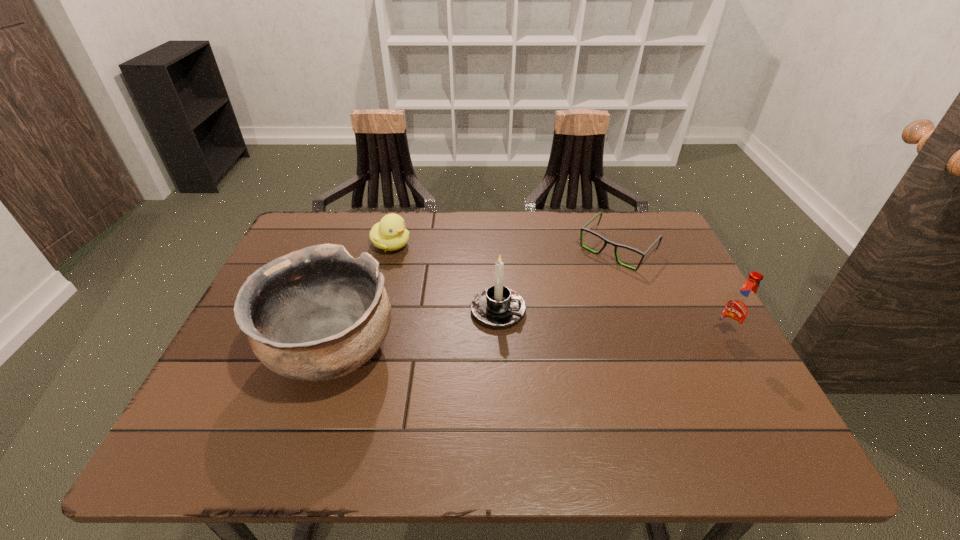
What are the coordinates of `vacant space that's between the rightmost object and the shortest object` in the screenshot? It's located at (671, 293).

You are a GUI agent. You are given a task and a screenshot of the screen. Output one action in this format:
    pyautogui.click(x=<x>, y=<y>)
    Task: Click on the empty space between the rightmost object and the duckling
    The height and width of the screenshot is (540, 960).
    Given the screenshot: What is the action you would take?
    pyautogui.click(x=558, y=291)

At what (x,y) coordinates should I click in order to perform the action: click on free space between the fourth tallest object and the rightmost object. Please return your answer as a coordinate pair (x, y). This screenshot has height=540, width=960. Looking at the image, I should click on (558, 291).

Where is `vacant area that lies between the second shortest object and the rightmost object`? Image resolution: width=960 pixels, height=540 pixels. vacant area that lies between the second shortest object and the rightmost object is located at coordinates (558, 291).

At what (x,y) coordinates should I click in order to perform the action: click on unoccupied position between the pottery and the root beer. Please return your answer as a coordinate pair (x, y). This screenshot has width=960, height=540. Looking at the image, I should click on (529, 344).

Where is `free point between the root beer and the third object from left to right`? This screenshot has width=960, height=540. free point between the root beer and the third object from left to right is located at coordinates (612, 323).

Locate an element on the screen. This screenshot has width=960, height=540. free space between the second object from right to left and the rightmost object is located at coordinates (671, 293).

What are the coordinates of `free space between the duckling and the shortest object` in the screenshot? It's located at (504, 247).

I want to click on the second closest object to the rightmost object, so click(x=498, y=306).

Locate which object ranks second in proximity to the pottery. Please provide its 2D coordinates. Your answer should be formatted as a tuple, i.e. [(x, y)], where the tuple contains the x and y coordinates of a point satisfying the conditions above.

[(390, 234)]